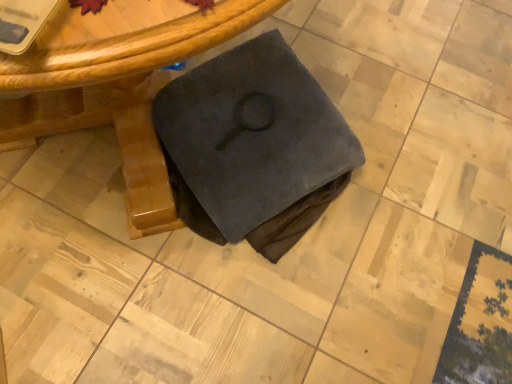
Find the location of a particular element. Image resolution: width=512 pixels, height=384 pixels. vacant area located to the right-hand side of dark suede book at center is located at coordinates (415, 185).